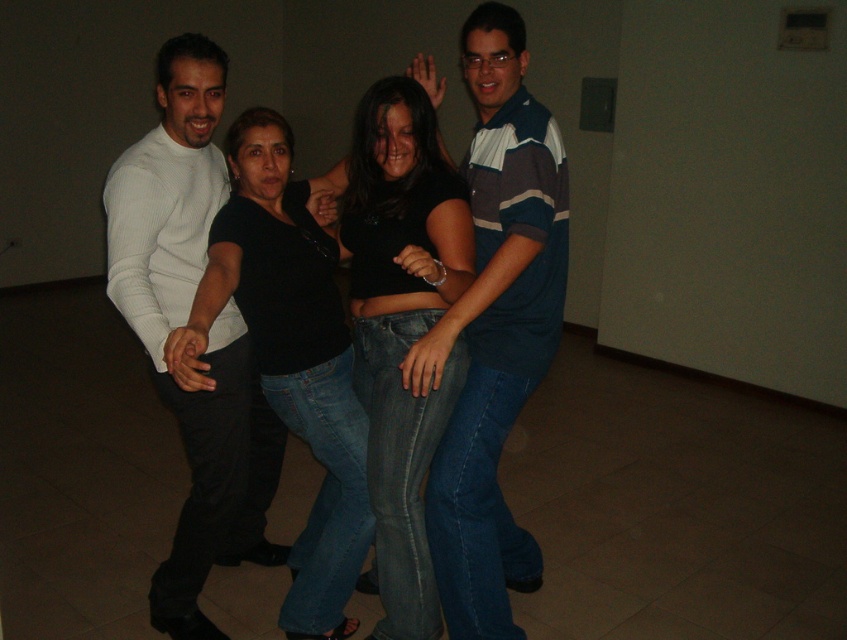
You are designing a new layout for a clothing store display. You have two shirts in the center of the display area, a striped cotton shirt at center and a black matte shirt at center. The store manager wants to arrange them so that the taller shirt is placed on a higher shelf to draw attention. Which shirt should be placed on the higher shelf?

The striped cotton shirt at center should be placed on the higher shelf because it has a greater height compared to the black matte shirt at center, making it the taller of the two.

You are a photographer setting up a shoot in the room described. You need to position a small tripod between the white ribbed sweater at left and the black denim jeans at center. The tripod requires at least 12 inches of space to be placed securely. Can you fit it between them?

The distance between the white ribbed sweater at left and the black denim jeans at center is 18.85 inches, which is more than the required 12 inches. Therefore, the tripod can be securely placed between them.

You are standing in the room and want to pick up the white ribbed sweater at left and the black denim jeans at center. Which item will you need to reach for first?

The white ribbed sweater at left is closer to the viewer than the black denim jeans at center, so you should reach for the white ribbed sweater at left first.